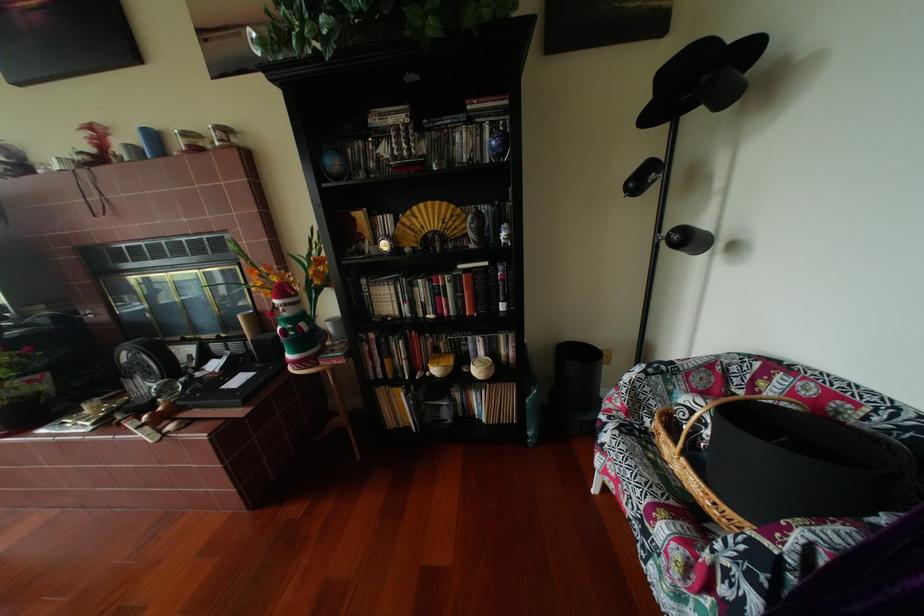
What do you see at coordinates (798, 464) in the screenshot? I see `the black hat` at bounding box center [798, 464].